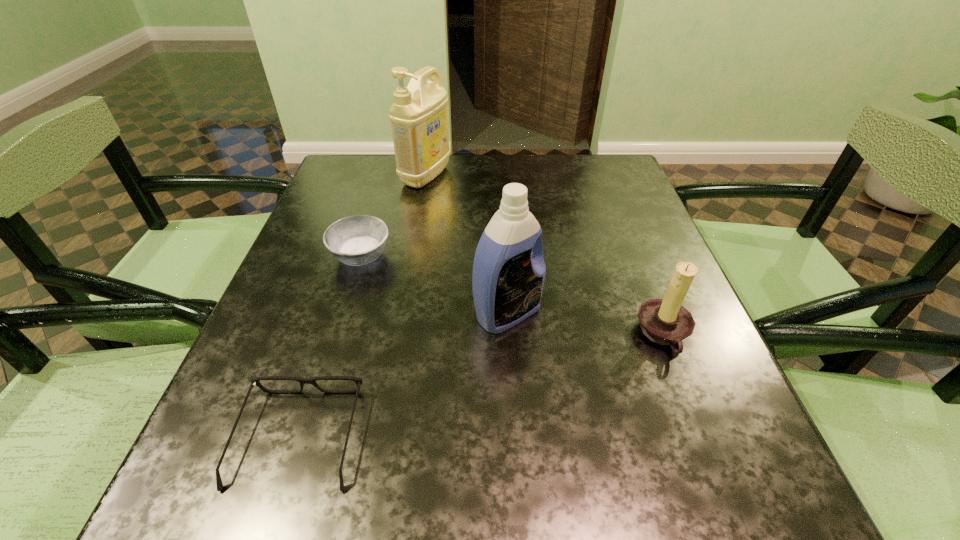
This screenshot has height=540, width=960. What are the coordinates of `the left detergent` in the screenshot? It's located at (419, 115).

Where is `the farther detergent`? This screenshot has height=540, width=960. the farther detergent is located at coordinates (419, 115).

Find the location of a particular element. the right detergent is located at coordinates (508, 278).

This screenshot has width=960, height=540. In order to click on the nearer detergent in this screenshot , I will do `click(508, 278)`.

Locate an element on the screen. candle holder is located at coordinates (665, 321).

Find the location of `the rightmost object`. the rightmost object is located at coordinates (665, 321).

Where is `ashtray`? The image size is (960, 540). ashtray is located at coordinates (357, 240).

Locate an element on the screen. The width and height of the screenshot is (960, 540). the second farthest object is located at coordinates point(357,240).

You are a GUI agent. You are given a task and a screenshot of the screen. Output one action in this format:
    pyautogui.click(x=<x>, y=<y>)
    Task: Click on the nearest object
    
    Given the screenshot: What is the action you would take?
    pyautogui.click(x=255, y=381)

At what (x,y) coordinates should I click in order to perform the action: click on spectacles. Please return your answer as a coordinate pair (x, y). This screenshot has height=540, width=960. Looking at the image, I should click on (255, 381).